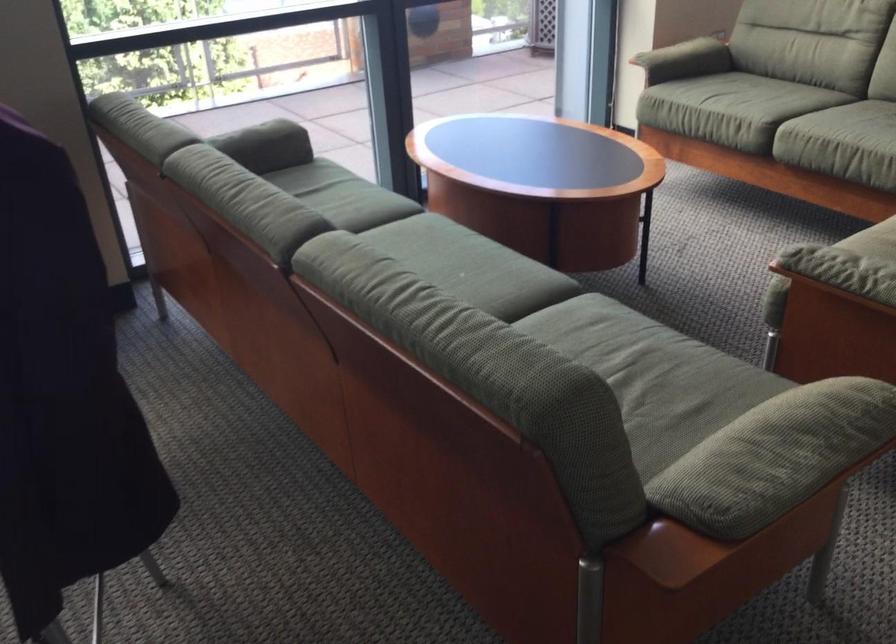
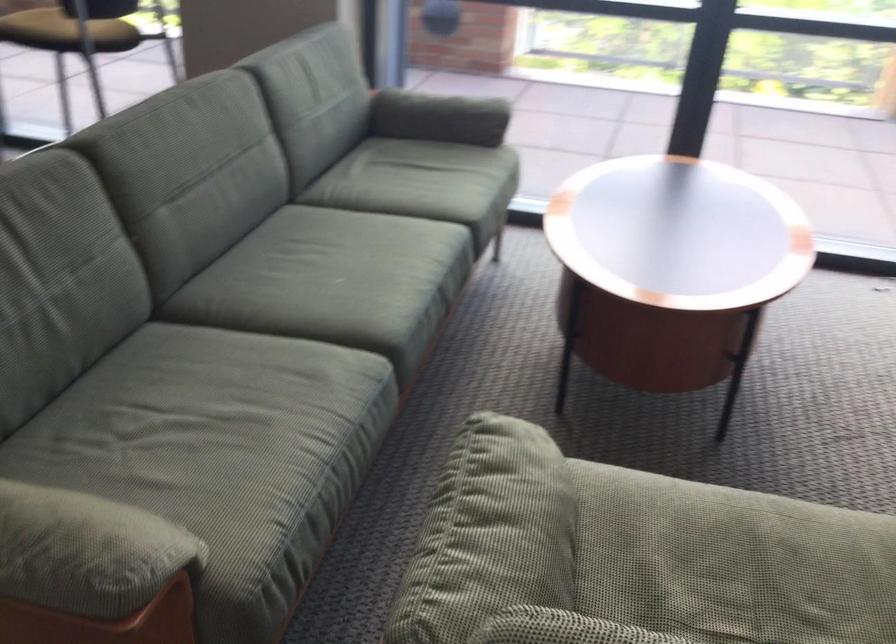
Where in the second image is the point corresponding to (x=648, y=368) from the first image?

(225, 430)